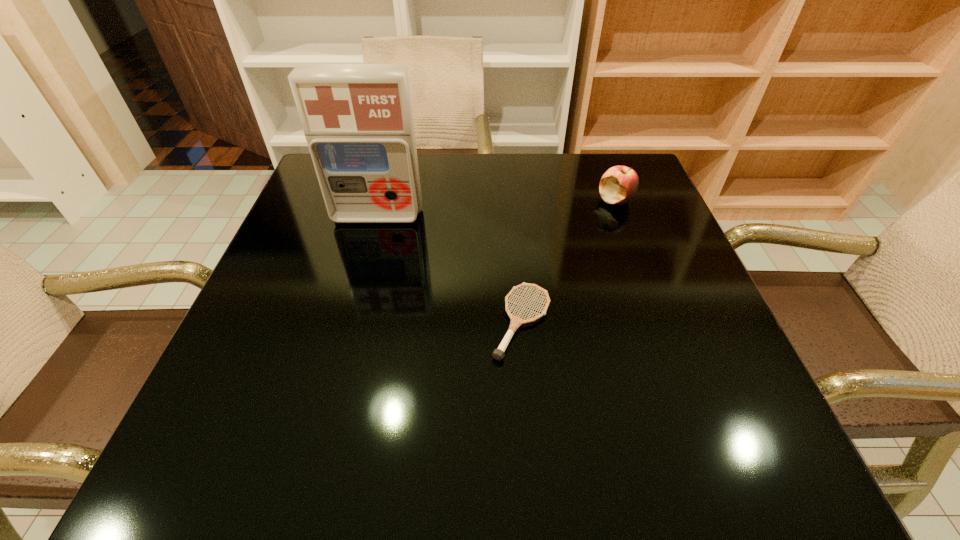
The height and width of the screenshot is (540, 960). What are the coordinates of `the second closest object relative to the nearest object` in the screenshot? It's located at (618, 185).

Identify the location of object identified as the second closest to the leftmost object. (618, 185).

Locate an element on the screen. The width and height of the screenshot is (960, 540). free space that satisfies the following two spatial constraints: 1. on the front-facing side of the leftmost object; 2. on the right side of the second object from right to left is located at coordinates pyautogui.click(x=348, y=322).

The width and height of the screenshot is (960, 540). Identify the location of vacant space that satisfies the following two spatial constraints: 1. on the front-facing side of the first-aid kit; 2. on the left side of the second object from left to right. (348, 322).

What are the coordinates of `vacant area that satisfies the following two spatial constraints: 1. on the back side of the shortest object; 2. on the left side of the rightmost object` in the screenshot? It's located at (512, 200).

This screenshot has width=960, height=540. I want to click on vacant space that satisfies the following two spatial constraints: 1. on the front-facing side of the tallest object; 2. on the right side of the tennis racket, so click(348, 322).

Locate an element on the screen. free spot that satisfies the following two spatial constraints: 1. on the front-facing side of the tallest object; 2. on the right side of the nearest object is located at coordinates (348, 322).